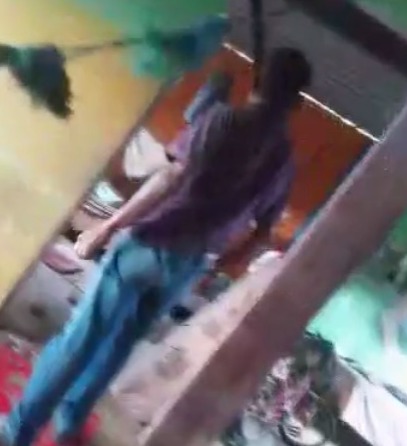
Where is `yellow wall`? This screenshot has height=446, width=407. yellow wall is located at coordinates (55, 153).